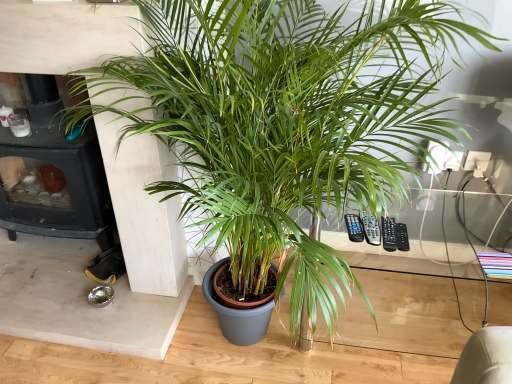
Describe the element at coordinates (53, 173) in the screenshot. I see `black glass fireplace at left` at that location.

I want to click on black glass fireplace at left, so click(53, 173).

The image size is (512, 384). Identify the location of black glass fireplace at left. (53, 173).